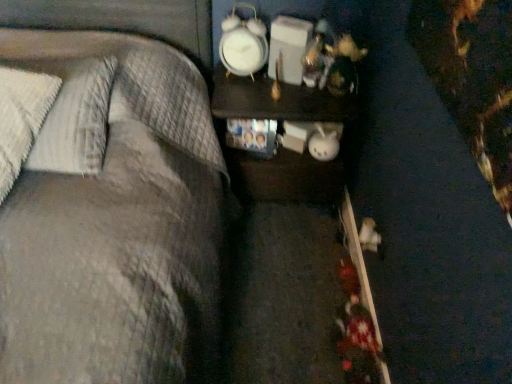
Question: Should I look upward or downward to see white plastic clock at upper center?

Choices:
 (A) down
 (B) up

Answer: (B)

Question: Is white plastic clock at upper center looking in the opposite direction of white textured pillow at left?

Choices:
 (A) yes
 (B) no

Answer: (B)

Question: Is white plastic clock at upper center at the right side of white textured pillow at left?

Choices:
 (A) no
 (B) yes

Answer: (B)

Question: From a real-world perspective, is white plastic clock at upper center beneath white textured pillow at left?

Choices:
 (A) no
 (B) yes

Answer: (B)

Question: Is white plastic clock at upper center to the left of white textured pillow at left from the viewer's perspective?

Choices:
 (A) yes
 (B) no

Answer: (B)

Question: From the image's perspective, would you say white plastic clock at upper center is shown under white textured pillow at left?

Choices:
 (A) yes
 (B) no

Answer: (B)

Question: Is white plastic clock at upper center oriented towards white textured pillow at left?

Choices:
 (A) yes
 (B) no

Answer: (B)

Question: Would you say white plastic clock at upper center is a long distance from dark wood nightstand at center?

Choices:
 (A) yes
 (B) no

Answer: (B)

Question: Is white plastic clock at upper center taller than dark wood nightstand at center?

Choices:
 (A) yes
 (B) no

Answer: (B)

Question: Is white plastic clock at upper center to the right of dark wood nightstand at center from the viewer's perspective?

Choices:
 (A) no
 (B) yes

Answer: (A)

Question: Does white plastic clock at upper center have a greater width compared to dark wood nightstand at center?

Choices:
 (A) no
 (B) yes

Answer: (A)

Question: Considering the relative sizes of white plastic clock at upper center and dark wood nightstand at center in the image provided, is white plastic clock at upper center bigger than dark wood nightstand at center?

Choices:
 (A) no
 (B) yes

Answer: (A)

Question: Is white plastic clock at upper center aimed at dark wood nightstand at center?

Choices:
 (A) no
 (B) yes

Answer: (A)

Question: Considering the relative positions of white textured pillow at left and dark wood nightstand at center in the image provided, is white textured pillow at left behind dark wood nightstand at center?

Choices:
 (A) no
 (B) yes

Answer: (A)